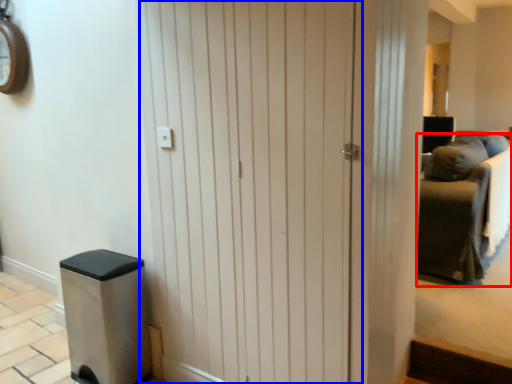
Question: Which of the following is the closest to the observer, furniture (highlighted by a red box) or barn door (highlighted by a blue box)?

Choices:
 (A) furniture
 (B) barn door

Answer: (B)